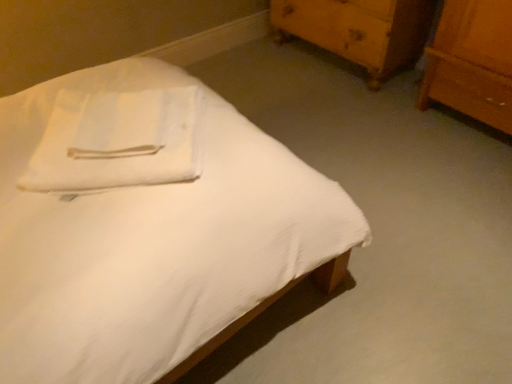
In order to click on vacant region below wooden chest of drawers at upper right (from a real-world perspective) in this screenshot , I will do `click(326, 64)`.